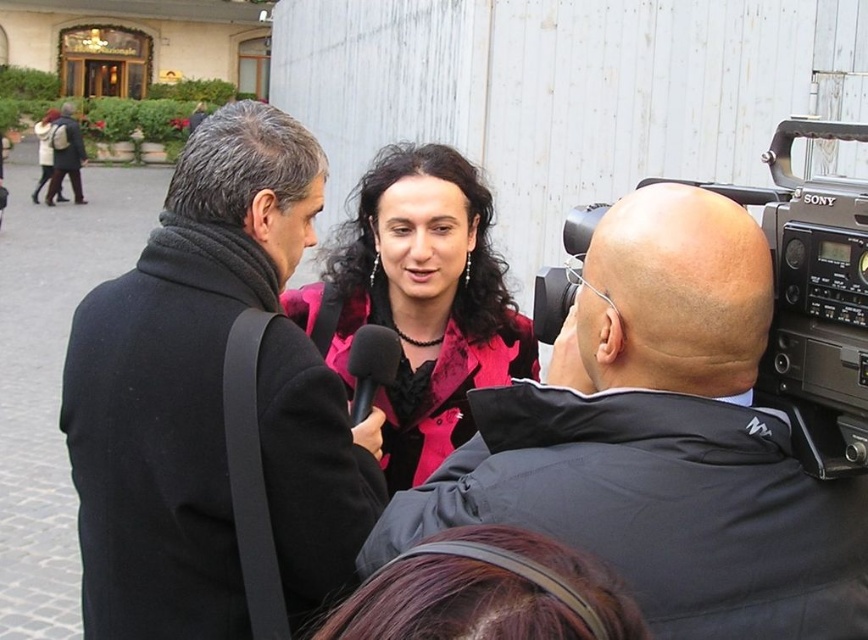
Question: Does black wool coat at left have a larger size compared to pink satin jacket at center?

Choices:
 (A) yes
 (B) no

Answer: (B)

Question: Considering the real-world distances, which object is farthest from the black matte microphone at center?

Choices:
 (A) pink satin jacket at center
 (B) black wool coat at left
 (C) black plastic camera at upper right

Answer: (C)

Question: Can you confirm if pink satin jacket at center is positioned to the left of black matte microphone at center?

Choices:
 (A) no
 (B) yes

Answer: (A)

Question: Which object appears closest to the camera in this image?

Choices:
 (A) black plastic camera at upper right
 (B) black matte microphone at center
 (C) black matte jacket at center

Answer: (C)

Question: Among these points, which one is nearest to the camera?

Choices:
 (A) (829, 264)
 (B) (172, 426)
 (C) (451, 305)

Answer: (A)

Question: Can you confirm if pink satin jacket at center is bigger than black plastic camera at upper right?

Choices:
 (A) no
 (B) yes

Answer: (B)